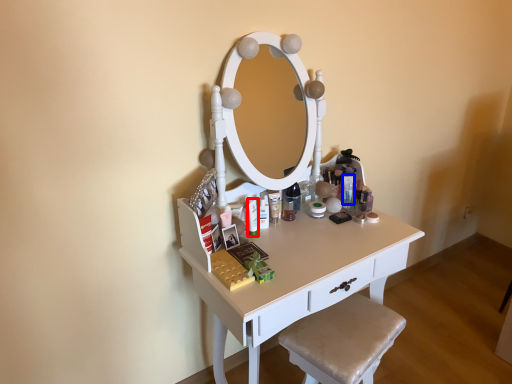
Question: Among these objects, which one is nearest to the camera, toiletry (highlighted by a red box) or toiletry (highlighted by a blue box)?

Choices:
 (A) toiletry
 (B) toiletry

Answer: (A)